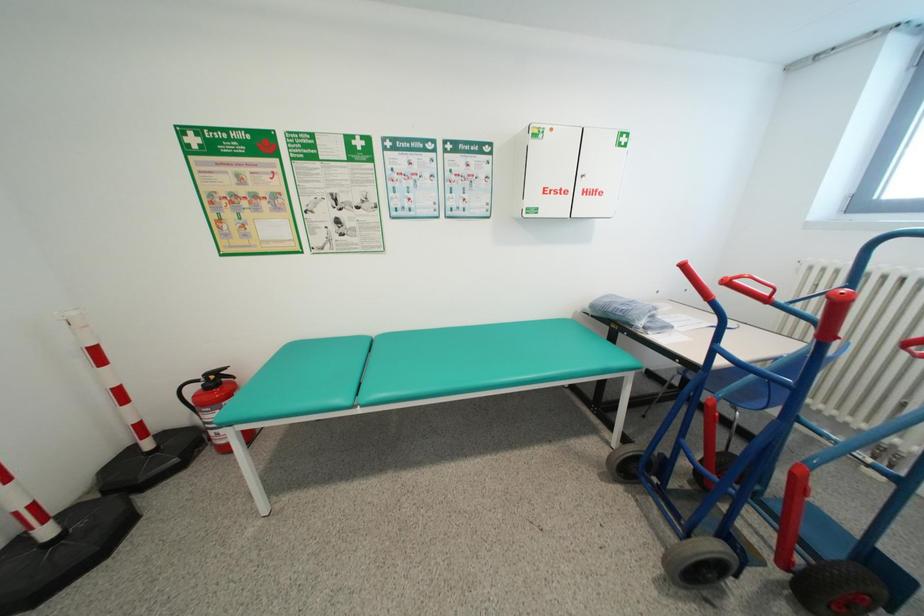
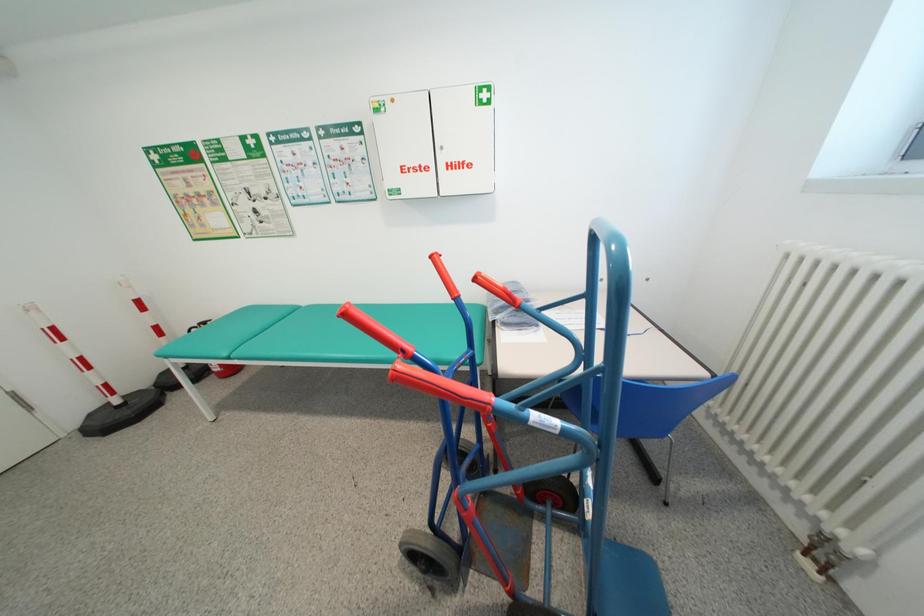
Question: The images are taken continuously from a first-person perspective. In which direction are you moving?

Choices:
 (A) Left
 (B) Right
 (C) Forward
 (D) Backward

Answer: (B)